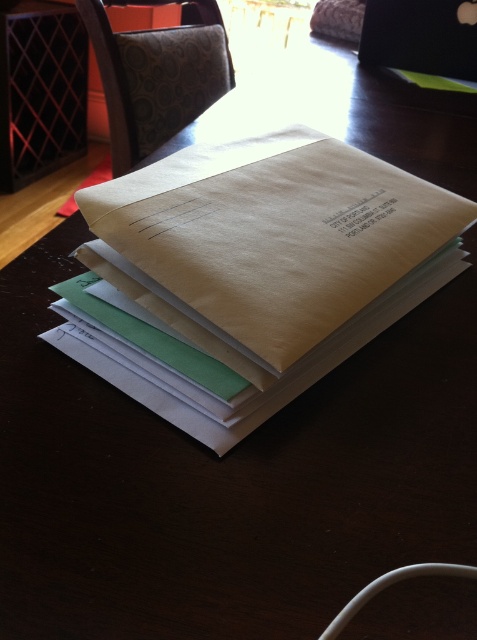
You are organizing documents on a desk and need to place the brown paper book at center and the black glossy laptop at upper right. Based on their positions, which object is closer to you?

The brown paper book at center is closer to you since it is in front of the black glossy laptop at upper right.

You are organizing documents on a desk and notice the matte paper envelope at center and the brown paper book at center. Which one has a greater height?

The matte paper envelope at center is much taller than the brown paper book at center, so it has a greater height.

You are organizing documents on a desk and see the matte paper envelope at center and the black glossy laptop at upper right. Which object is positioned to the right side of the other?

The matte paper envelope at center is to the left of the black glossy laptop at upper right, so the black glossy laptop at upper right is positioned to the right side of the matte paper envelope at center.